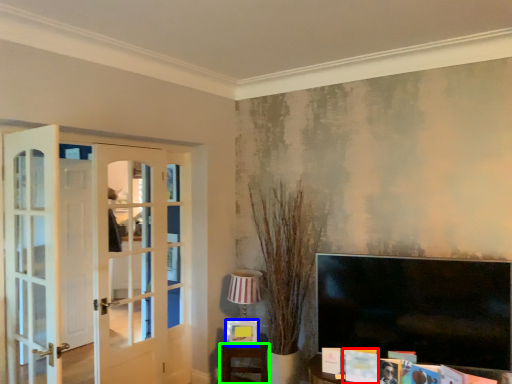
Question: Which object is positioned farthest from magazine (highlighted by a red box)? Select from picture frame (highlighted by a blue box) and furniture (highlighted by a green box).

Choices:
 (A) picture frame
 (B) furniture

Answer: (B)